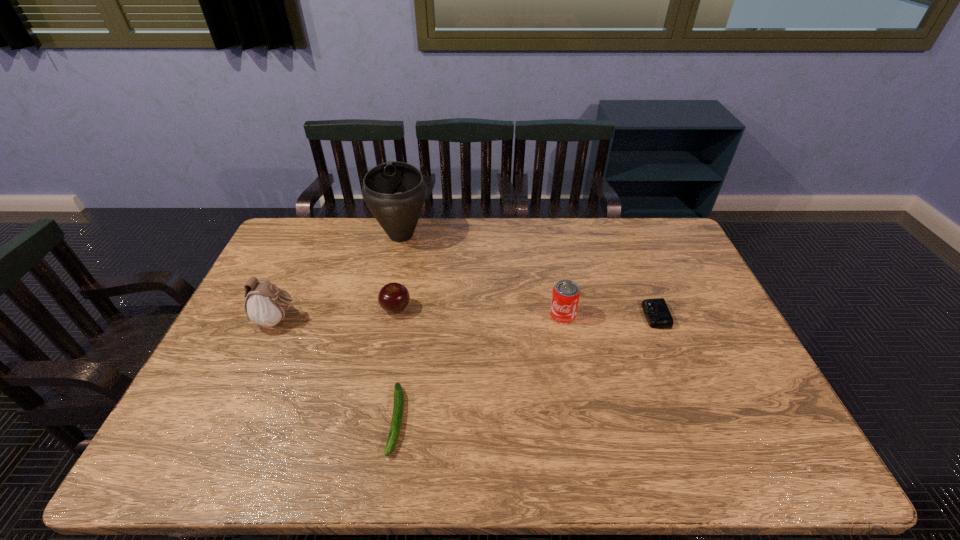
I want to click on free space between the nearest object and the pouch, so click(338, 370).

I want to click on free space between the leftmost object and the second object from right to left, so click(x=420, y=318).

Locate an element on the screen. The image size is (960, 540). vacant area between the alarm clock and the tallest object is located at coordinates (528, 275).

The width and height of the screenshot is (960, 540). Identify the location of empty space that is in between the pouch and the tallest object. (340, 278).

Identify the location of object that is the closest to the pouch. This screenshot has width=960, height=540. (394, 297).

Where is `the second closest object to the apple`? The width and height of the screenshot is (960, 540). the second closest object to the apple is located at coordinates (265, 305).

Locate an element on the screen. Image resolution: width=960 pixels, height=540 pixels. vacant space that satisfies the following two spatial constraints: 1. on the front side of the fourth shortest object; 2. on the left side of the apple is located at coordinates (395, 315).

This screenshot has width=960, height=540. Find the location of `free spot that satisfies the following two spatial constraints: 1. on the front side of the third shortest object; 2. on the front-facing side of the leftmost object`. free spot that satisfies the following two spatial constraints: 1. on the front side of the third shortest object; 2. on the front-facing side of the leftmost object is located at coordinates (x=394, y=320).

I want to click on vacant space that satisfies the following two spatial constraints: 1. on the display of the rightmost object; 2. on the front-facing side of the zucchini, so click(698, 420).

Where is `vacant space that satisfies the following two spatial constraints: 1. on the display of the alarm clock; 2. on the front-facing side of the nearest object`? The image size is (960, 540). vacant space that satisfies the following two spatial constraints: 1. on the display of the alarm clock; 2. on the front-facing side of the nearest object is located at coordinates (698, 420).